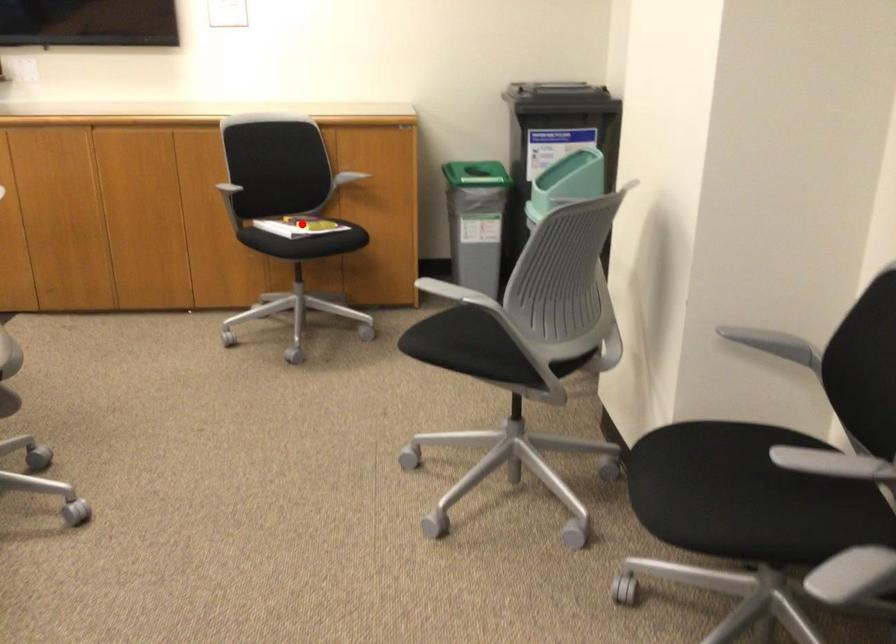
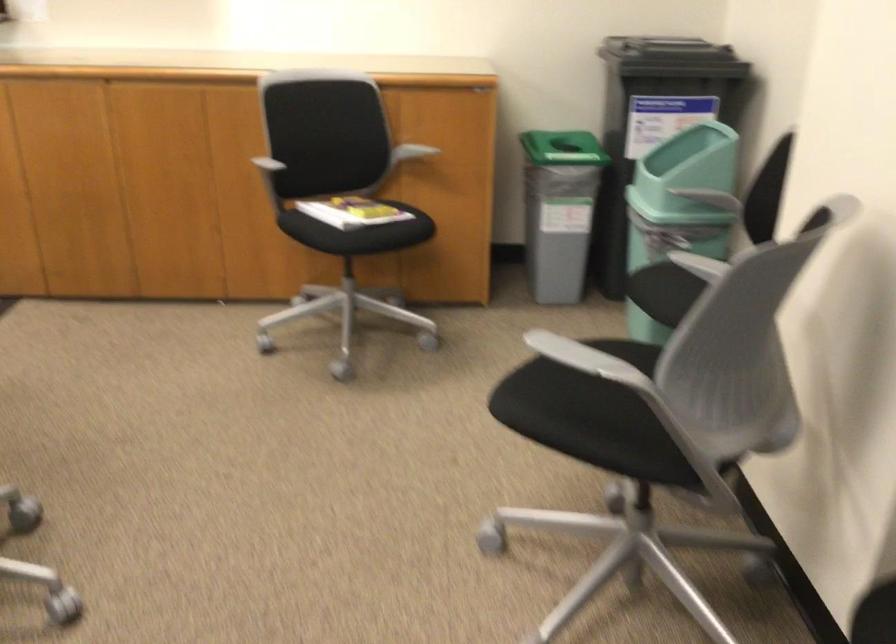
Question: I am providing you with two images of the same scene from different viewpoints. In image1, a red point is highlighted. Considering the same 3D point in image2, which of the following is correct?

Choices:
 (A) It is closer
 (B) It is farther

Answer: (A)